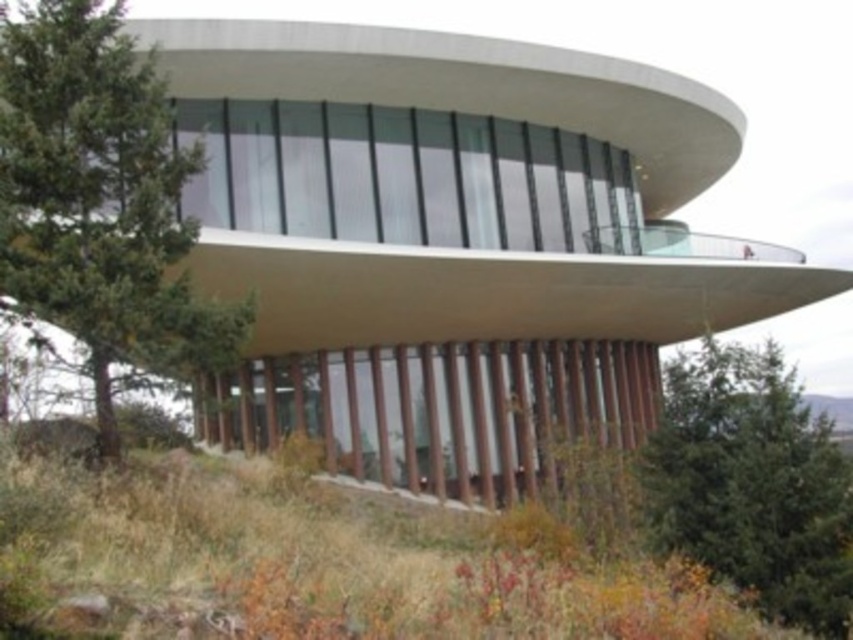
Question: From the image, what is the correct spatial relationship of green coniferous tree at left in relation to green leafy tree at lower right?

Choices:
 (A) left
 (B) right

Answer: (A)

Question: Is green coniferous tree at left to the left of green leafy tree at lower right from the viewer's perspective?

Choices:
 (A) yes
 (B) no

Answer: (A)

Question: Is green coniferous tree at left wider than green leafy tree at lower right?

Choices:
 (A) yes
 (B) no

Answer: (A)

Question: Which point is closer to the camera taking this photo?

Choices:
 (A) (73, 292)
 (B) (675, 392)

Answer: (A)